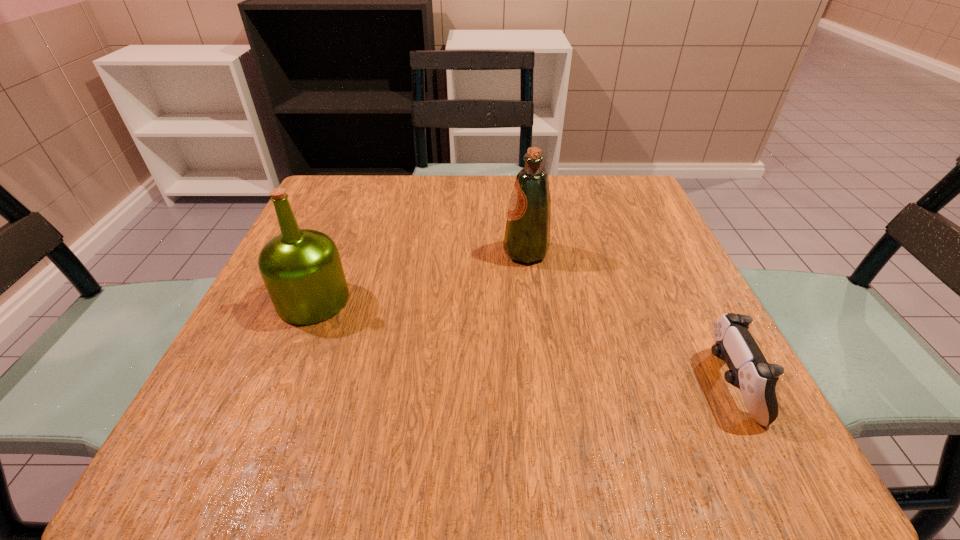
The height and width of the screenshot is (540, 960). Identify the location of free space at the right edge. (628, 251).

At what (x,y) coordinates should I click in order to perform the action: click on vacant space at the far right corner of the desktop. Please return your answer as a coordinate pair (x, y). Looking at the image, I should click on (603, 195).

Locate an element on the screen. free spot between the control and the right olive oil is located at coordinates (628, 318).

You are a GUI agent. You are given a task and a screenshot of the screen. Output one action in this format:
    pyautogui.click(x=<x>, y=<y>)
    Task: Click on the vacant space that's between the rightmost object and the left olive oil
    The width and height of the screenshot is (960, 540).
    Given the screenshot: What is the action you would take?
    pyautogui.click(x=521, y=342)

This screenshot has height=540, width=960. In order to click on free spot between the right olive oil and the rightmost object in this screenshot , I will do `click(628, 318)`.

Identify the location of free space between the leftmost object and the second object from right to left. The width and height of the screenshot is (960, 540). (420, 276).

The width and height of the screenshot is (960, 540). What are the coordinates of `free space between the nearest object and the second object from right to left` in the screenshot? It's located at (628, 318).

This screenshot has height=540, width=960. In order to click on free space between the control and the second farthest object in this screenshot , I will do `click(521, 342)`.

Identify the location of free space that is in between the second object from left to right and the leftmost object. (420, 276).

This screenshot has width=960, height=540. In order to click on free space between the control and the second object from left to right in this screenshot , I will do 628,318.